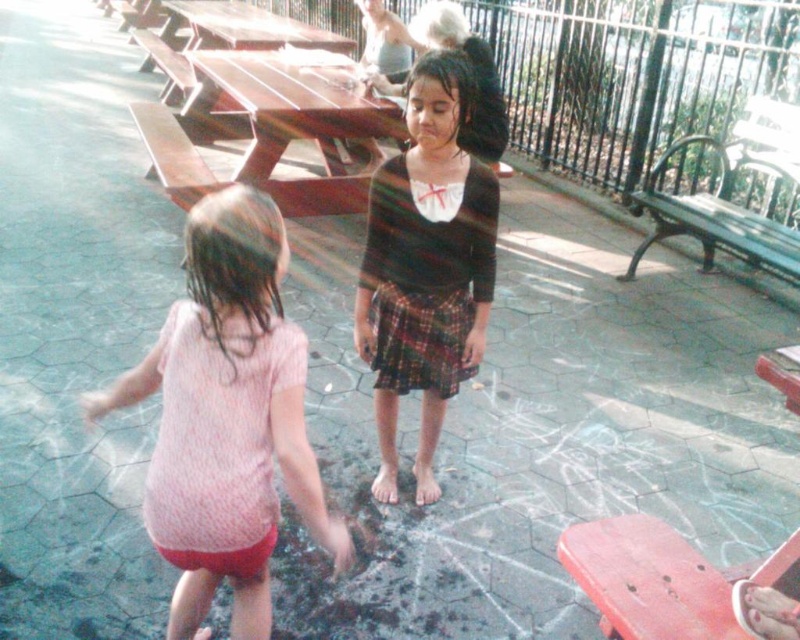
You are a photographer trying to capture both the pink fabric shirt at center and the striped knit sweater at center in a single frame. Since your camera has a limited focus range, you need to know which object is larger to adjust the focus properly. Which one is larger?

The pink fabric shirt at center is bigger than the striped knit sweater at center, so you should focus on the pink fabric shirt at center first as it requires more focus due to its larger size.